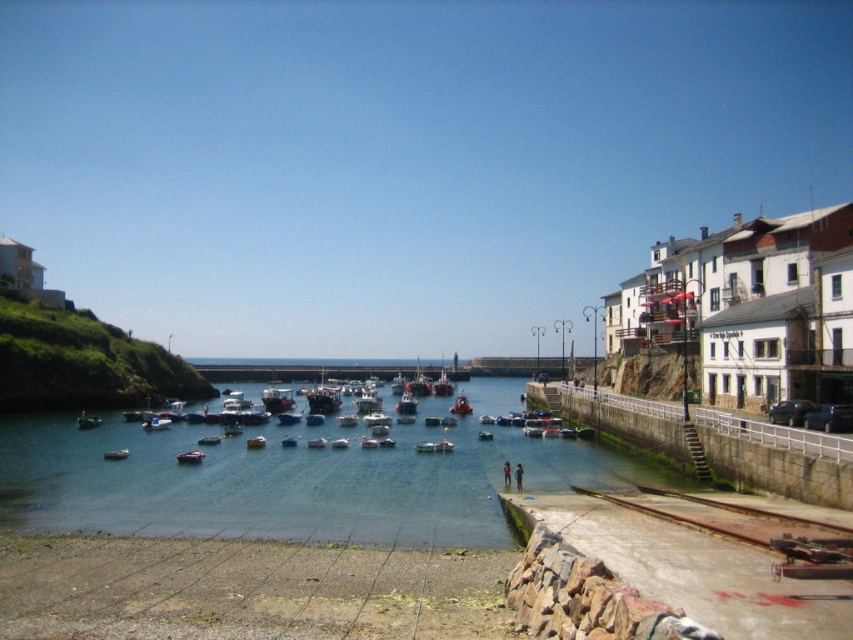
Does metallic silver boat at lower left appear over metallic blue boat at center?

Correct, metallic silver boat at lower left is located above metallic blue boat at center.

Who is positioned more to the right, metallic silver boat at lower left or metallic blue boat at center?

metallic blue boat at center

Does point (112, 458) come farther from viewer compared to point (219, 436)?

No, (112, 458) is closer to viewer.

Locate an element on the screen. metallic silver boat at lower left is located at coordinates (115, 454).

Can you confirm if blue matte boat at center is thinner than metallic silver boat at lower left?

Indeed, blue matte boat at center has a lesser width compared to metallic silver boat at lower left.

Consider the image. Which is more to the left, blue matte boat at center or metallic silver boat at lower left?

blue matte boat at center is more to the left.

Locate an element on the screen. blue matte boat at center is located at coordinates (155, 422).

Locate an element on the screen. The image size is (853, 640). blue matte boat at center is located at coordinates (155, 422).

How much distance is there between metallic silver boat at center and metallic blue boat at center?

metallic silver boat at center and metallic blue boat at center are 21.60 feet apart from each other.

Is point (187, 458) in front of point (215, 438)?

That is True.

Identify the location of metallic silver boat at center. Image resolution: width=853 pixels, height=640 pixels. pos(190,456).